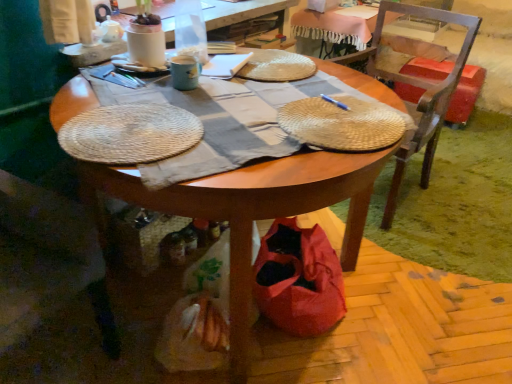
Locate an element on the screen. vacant space situated on the left part of matte ceramic mug at upper center is located at coordinates (136, 80).